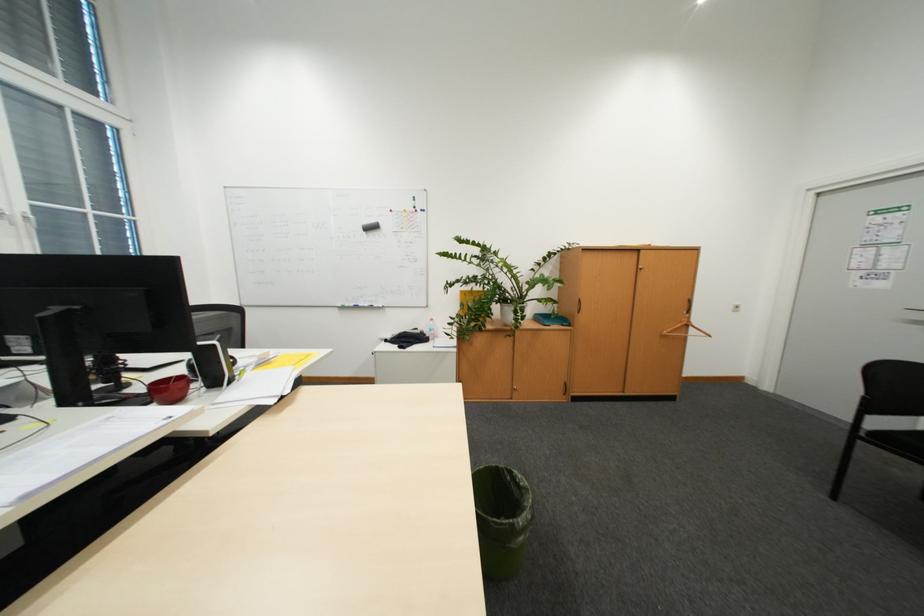
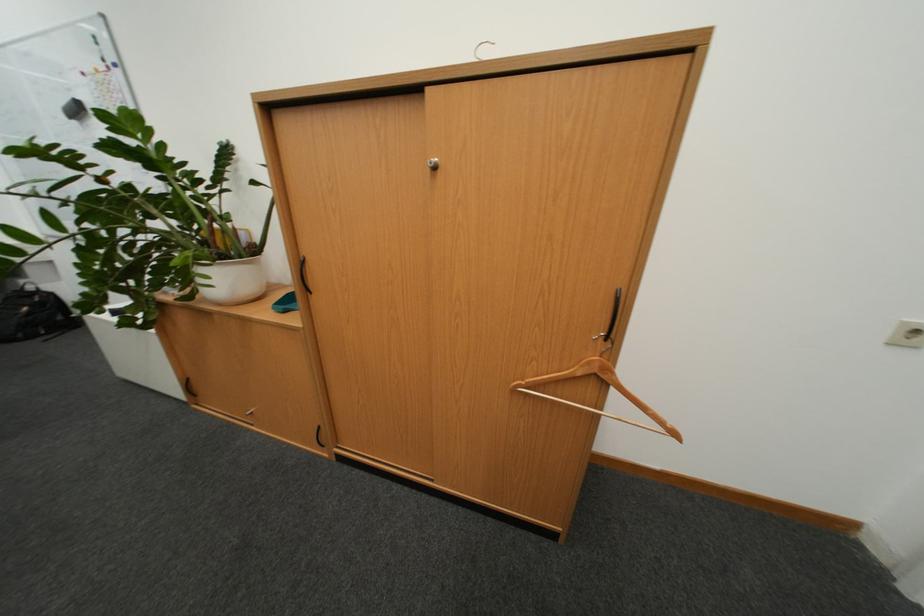
What movement of the cameraman would produce the second image?

The cameraman walked toward right, forward.